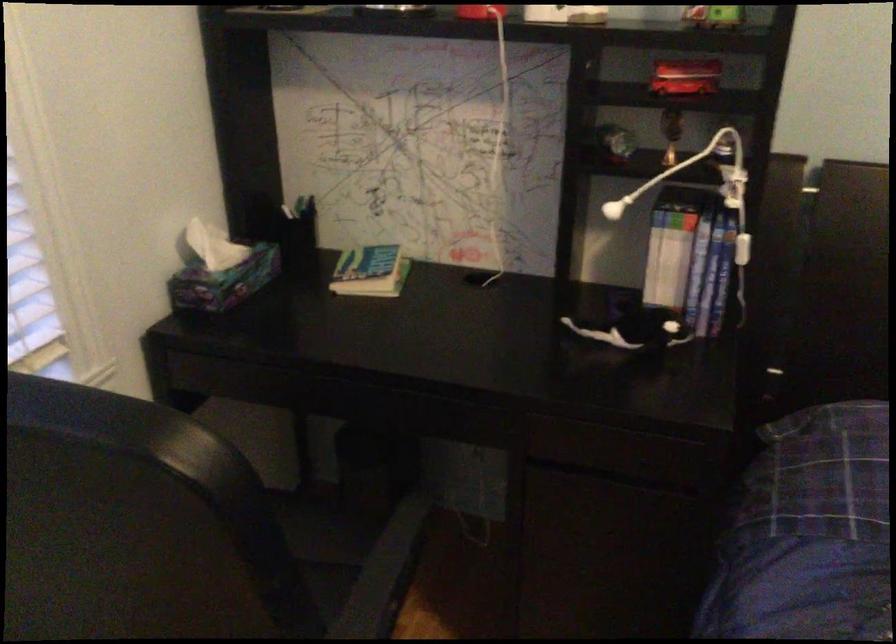
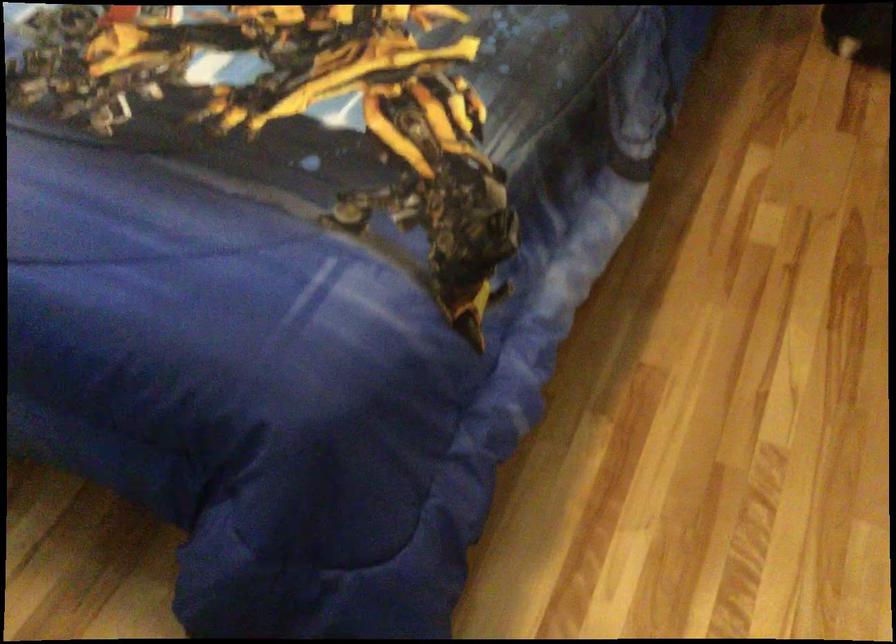
In a continuous first-person perspective shot, in which direction is the camera moving?

The cameraman moved toward right, backward.